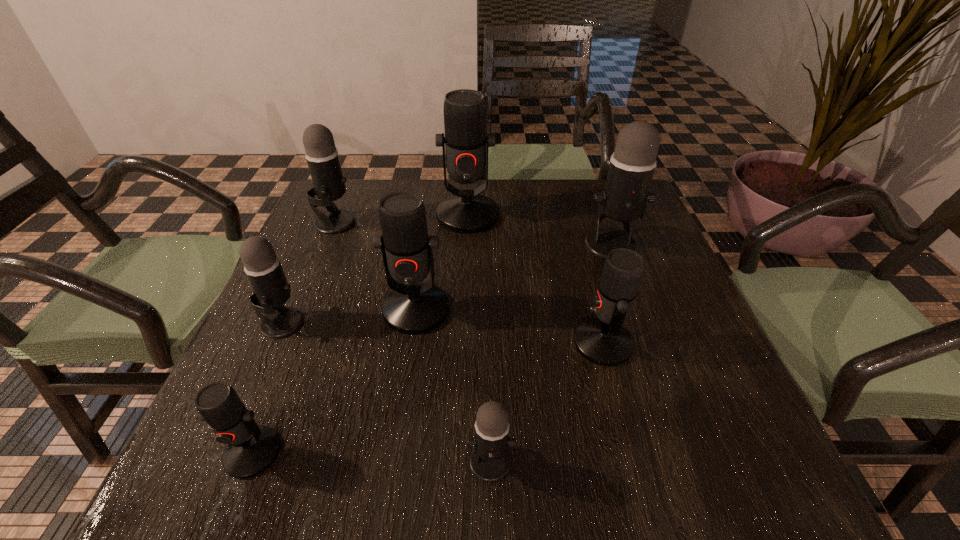
Locate which red microphone ranks third in proximity to the second smallest gray microphone. Please provide its 2D coordinates. Your answer should be formatted as a tuple, i.e. [(x, y)], where the tuple contains the x and y coordinates of a point satisfying the conditions above.

[(467, 211)]

Locate which gray microphone is the third closest to the second biggest red microphone. Please provide its 2D coordinates. Your answer should be formatted as a tuple, i.e. [(x, y)], where the tuple contains the x and y coordinates of a point satisfying the conditions above.

[(490, 461)]

Locate an element on the screen. gray microphone identified as the second closest to the rightmost red microphone is located at coordinates point(490,461).

Locate an element on the screen. free space that satisfies the following two spatial constraints: 1. on the side of the third biggest red microphone with the red ring; 2. on the side of the smallest red microphone with the red ring is located at coordinates (632, 453).

You are a GUI agent. You are given a task and a screenshot of the screen. Output one action in this format:
    pyautogui.click(x=<x>, y=<y>)
    Task: Click on the free space in the image that satisfies the following two spatial constraints: 1. on the side of the biggest red microphone with the red ring; 2. on the left side of the biggest gray microphone
    The height and width of the screenshot is (540, 960).
    Given the screenshot: What is the action you would take?
    [x=467, y=245]